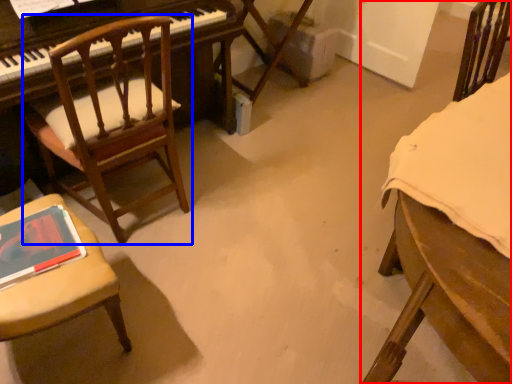
Question: Which object appears farthest to the camera in this image, chair (highlighted by a red box) or chair (highlighted by a blue box)?

Choices:
 (A) chair
 (B) chair

Answer: (B)